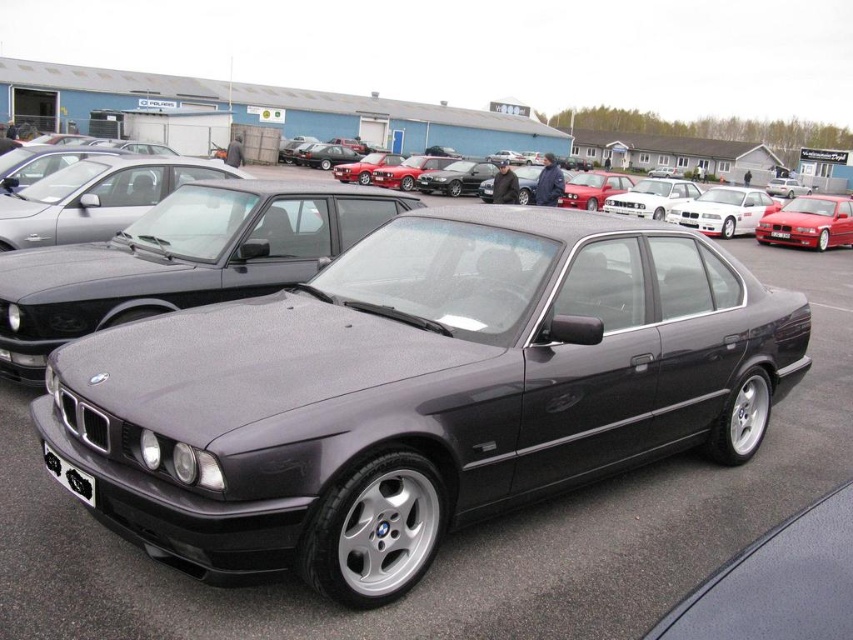
Does metallic red sedan at right have a lesser width compared to black plastic license plate at center?

Incorrect, metallic red sedan at right's width is not less than black plastic license plate at center's.

Between metallic red sedan at right and black plastic license plate at center, which one is positioned lower?

black plastic license plate at center

This screenshot has height=640, width=853. I want to click on metallic red sedan at right, so click(809, 221).

Does satin black car at center appear on the right side of metallic red sedan at right?

Incorrect, satin black car at center is not on the right side of metallic red sedan at right.

Does satin black car at center have a larger size compared to metallic red sedan at right?

No.

Does point (73, 260) lie in front of point (814, 243)?

Yes, it is.

The image size is (853, 640). Find the location of `satin black car at center`. satin black car at center is located at coordinates (181, 259).

Does satin black car at center have a greater height compared to black plastic license plate at center?

Indeed, satin black car at center has a greater height compared to black plastic license plate at center.

Which is below, satin black car at center or black plastic license plate at center?

satin black car at center

Does point (189, 300) come closer to viewer compared to point (775, 236)?

Yes, point (189, 300) is in front of point (775, 236).

The image size is (853, 640). In order to click on satin black car at center in this screenshot , I will do `click(181, 259)`.